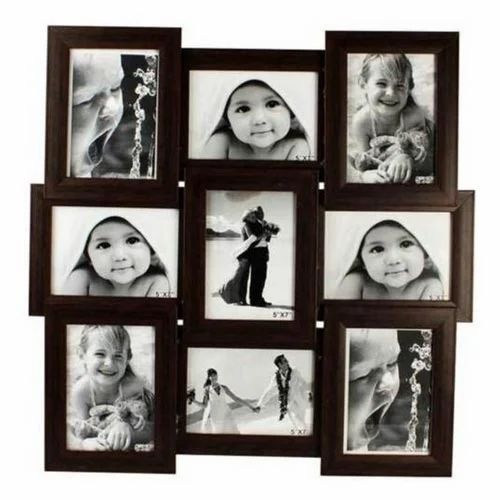
The width and height of the screenshot is (500, 500). Identify the location of frame. (401, 404), (264, 262), (402, 267), (389, 107), (282, 119), (123, 131), (124, 270), (118, 382), (254, 416).